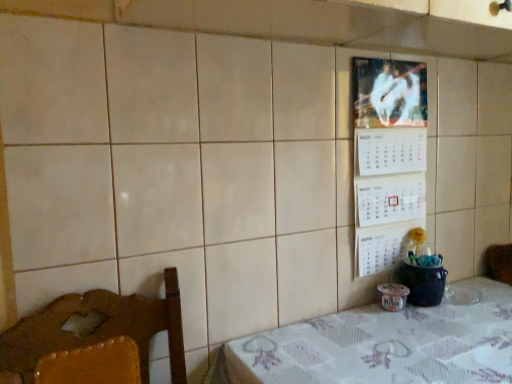
Question: Does white paper calendar at upper right come in front of white fabric table at lower right?

Choices:
 (A) yes
 (B) no

Answer: (B)

Question: Can you confirm if white paper calendar at upper right is smaller than white fabric table at lower right?

Choices:
 (A) yes
 (B) no

Answer: (A)

Question: Is the depth of white paper calendar at upper right greater than that of white fabric table at lower right?

Choices:
 (A) no
 (B) yes

Answer: (B)

Question: From a real-world perspective, is white paper calendar at upper right physically above white fabric table at lower right?

Choices:
 (A) no
 (B) yes

Answer: (B)

Question: Could you tell me if white paper calendar at upper right is turned towards white fabric table at lower right?

Choices:
 (A) yes
 (B) no

Answer: (B)

Question: From the image's perspective, is white paper calendar at upper right on white fabric table at lower right?

Choices:
 (A) no
 (B) yes

Answer: (B)

Question: Is white fabric table at lower right oriented away from white paper calendar at upper right?

Choices:
 (A) no
 (B) yes

Answer: (A)

Question: Is white paper calendar at upper right completely or partially inside white fabric table at lower right?

Choices:
 (A) yes
 (B) no

Answer: (B)

Question: Is white fabric table at lower right beside white paper calendar at upper right?

Choices:
 (A) yes
 (B) no

Answer: (B)

Question: Does white fabric table at lower right have a smaller size compared to white paper calendar at upper right?

Choices:
 (A) yes
 (B) no

Answer: (B)

Question: Does white fabric table at lower right have a greater width compared to white paper calendar at upper right?

Choices:
 (A) no
 (B) yes

Answer: (B)

Question: Would you say white fabric table at lower right is outside white paper calendar at upper right?

Choices:
 (A) no
 (B) yes

Answer: (B)

Question: Considering their positions, is white paper calendar at upper right located in front of or behind white fabric table at lower right?

Choices:
 (A) behind
 (B) front

Answer: (A)